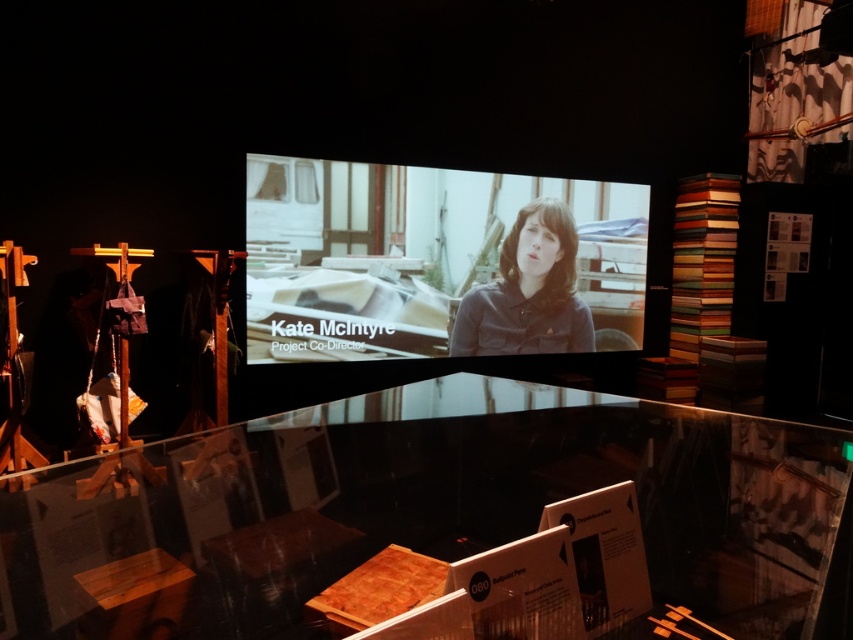
Is point (282, 493) less distant than point (520, 250)?

Yes, it is in front of point (520, 250).

Who is more distant from viewer, (16, 600) or (556, 317)?

Positioned behind is point (556, 317).

Where is `transparent glass table at center`? transparent glass table at center is located at coordinates (442, 524).

From the picture: Does matte black screen at center have a larger size compared to matte brown shirt at center?

Yes.

Between point (445, 339) and point (556, 280), which one is positioned in front?

Point (445, 339) is in front.

The image size is (853, 640). I want to click on matte black screen at center, so click(437, 262).

Does transparent glass table at center appear on the left side of matte black screen at center?

Yes, transparent glass table at center is to the left of matte black screen at center.

Is transparent glass table at center above matte black screen at center?

No, transparent glass table at center is not above matte black screen at center.

Describe the element at coordinates (442, 524) in the screenshot. I see `transparent glass table at center` at that location.

Find the location of a particular element. The height and width of the screenshot is (640, 853). transparent glass table at center is located at coordinates (442, 524).